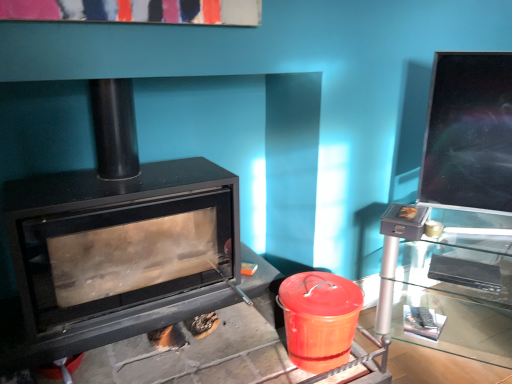
Measure the distance between point (x=49, y=193) and camera.

→ Point (x=49, y=193) is 4.86 feet from camera.

Where is `transparent glass table at right`? The image size is (512, 384). transparent glass table at right is located at coordinates (449, 283).

How different are the orientations of glossy ceramic crock pot at lower right and transparent glass table at right in degrees?

There is a 53-degree angle between the facing directions of glossy ceramic crock pot at lower right and transparent glass table at right.

Locate an element on the screen. crock pot that is under the transparent glass table at right (from a real-world perspective) is located at coordinates (319, 319).

Which of these two, glossy ceramic crock pot at lower right or transparent glass table at right, stands shorter?

glossy ceramic crock pot at lower right is shorter.

Which is more to the right, glossy ceramic crock pot at lower right or transparent glass table at right?

transparent glass table at right.

How different are the orientations of glossy ceramic crock pot at lower right and black matte wood burning stove at left in degrees?

There is a 0.00482-degree angle between the facing directions of glossy ceramic crock pot at lower right and black matte wood burning stove at left.

From the image's perspective, which one is positioned lower, glossy ceramic crock pot at lower right or black matte wood burning stove at left?

From the image's view, glossy ceramic crock pot at lower right is below.

Which object is wider, glossy ceramic crock pot at lower right or black matte wood burning stove at left?

With larger width is black matte wood burning stove at left.

Where is `wood burning stove located above the glossy ceramic crock pot at lower right (from the image's perspective)`? The height and width of the screenshot is (384, 512). wood burning stove located above the glossy ceramic crock pot at lower right (from the image's perspective) is located at coordinates (112, 221).

Consider the image. Considering the sizes of objects transparent glass table at right and glossy ceramic crock pot at lower right in the image provided, who is taller, transparent glass table at right or glossy ceramic crock pot at lower right?

transparent glass table at right is taller.

The height and width of the screenshot is (384, 512). I want to click on crock pot lying on the left of transparent glass table at right, so click(x=319, y=319).

Which point is more distant from viewer, (x=452, y=261) or (x=307, y=284)?

Point (x=452, y=261)

From a real-world perspective, between transparent glass table at right and glossy ceramic crock pot at lower right, who is vertically higher?

transparent glass table at right, from a real-world perspective.

Is glossy ceramic crock pot at lower right at the back of black matte wood burning stove at left?

That's not correct — black matte wood burning stove at left is not looking away from glossy ceramic crock pot at lower right.

Measure the distance between black matte wood burning stove at left and glossy ceramic crock pot at lower right.

A distance of 18.95 inches exists between black matte wood burning stove at left and glossy ceramic crock pot at lower right.

Does point (309, 115) come farther from viewer compared to point (344, 345)?

Yes, it is behind point (344, 345).

Looking at the image, does black matte wood burning stove at left seem bigger or smaller compared to glossy ceramic crock pot at lower right?

Considering their sizes, black matte wood burning stove at left takes up more space than glossy ceramic crock pot at lower right.

From the image's perspective, is black matte wood burning stove at left located beneath transparent glass table at right?

No.

Is black matte wood burning stove at left far away from transparent glass table at right?

No, black matte wood burning stove at left is not far away from transparent glass table at right.

Is black matte wood burning stove at left looking in the opposite direction of transparent glass table at right?

No, black matte wood burning stove at left is not facing away from transparent glass table at right.

From the image's perspective, between transparent glass table at right and black matte wood burning stove at left, who is located below?

transparent glass table at right.

Between transparent glass table at right and black matte wood burning stove at left, which one appears on the right side from the viewer's perspective?

From the viewer's perspective, transparent glass table at right appears more on the right side.

Can you confirm if transparent glass table at right is taller than black matte wood burning stove at left?

No.

You are a GUI agent. You are given a task and a screenshot of the screen. Output one action in this format:
    pyautogui.click(x=<x>, y=<y>)
    Task: Click on the crock pot on the left side of transparent glass table at right
    The width and height of the screenshot is (512, 384).
    Given the screenshot: What is the action you would take?
    pyautogui.click(x=319, y=319)

This screenshot has width=512, height=384. I want to click on crock pot below the black matte wood burning stove at left (from a real-world perspective), so click(x=319, y=319).

Looking at the image, which one is located further to transparent glass table at right, black matte wood burning stove at left or glossy ceramic crock pot at lower right?

black matte wood burning stove at left lies further to transparent glass table at right than the other object.

Looking at the image, which one is located further to glossy ceramic crock pot at lower right, transparent glass table at right or black matte wood burning stove at left?

black matte wood burning stove at left.

From the image, which object appears to be nearer to transparent glass table at right, glossy ceramic crock pot at lower right or black matte wood burning stove at left?

glossy ceramic crock pot at lower right is closer to transparent glass table at right.

From the image, which object appears to be farther from glossy ceramic crock pot at lower right, black matte wood burning stove at left or transparent glass table at right?

black matte wood burning stove at left lies further to glossy ceramic crock pot at lower right than the other object.

Considering their positions, is glossy ceramic crock pot at lower right positioned closer to black matte wood burning stove at left than transparent glass table at right?

Based on the image, glossy ceramic crock pot at lower right appears to be nearer to black matte wood burning stove at left.

When comparing their distances from black matte wood burning stove at left, does transparent glass table at right or glossy ceramic crock pot at lower right seem closer?

glossy ceramic crock pot at lower right.

I want to click on crock pot located between black matte wood burning stove at left and transparent glass table at right in the left-right direction, so click(x=319, y=319).